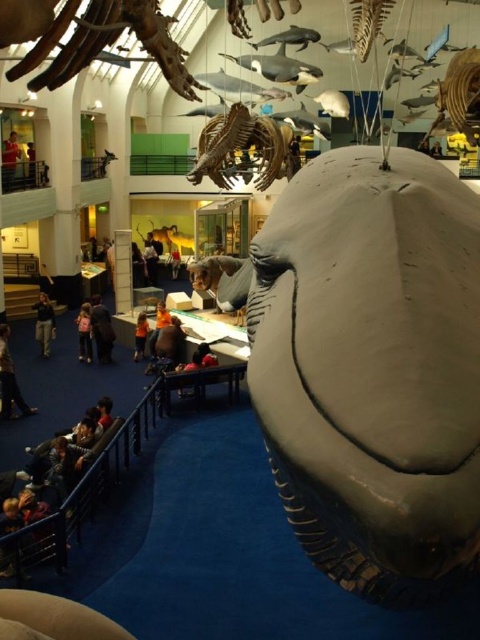
You are a visitor in the museum and want to take a photo of the whale model without any people in the frame. You notice a red shirt at upper left and a dark brown leather jacket at upper center in your current view. Which person should you move around to avoid blocking the whale model?

You should move around the red shirt at upper left because it is closer to the viewer than the dark brown leather jacket at upper center, making it more likely to block the photo.

You are an art curator planning to move the shiny metallic dinosaur skeleton at center and the dark brown fur at center to a new exhibition space. The new space has a height limit of 3 meters. Which object might require checking the height limit before moving?

The shiny metallic dinosaur skeleton at center is bigger than dark brown fur at center, so it might require checking the height limit before moving.

Consider the image. You are a visitor in the museum and want to take a photo of both the shiny metallic dinosaur skeleton at center and the dark brown fur at center. Which object should you focus on first to ensure both are in the frame?

The shiny metallic dinosaur skeleton at center is located above the dark brown fur at center. To ensure both are in the frame, focus on the shiny metallic dinosaur skeleton at center first as it is higher up, allowing the lower dark brown fur at center to be captured below it.